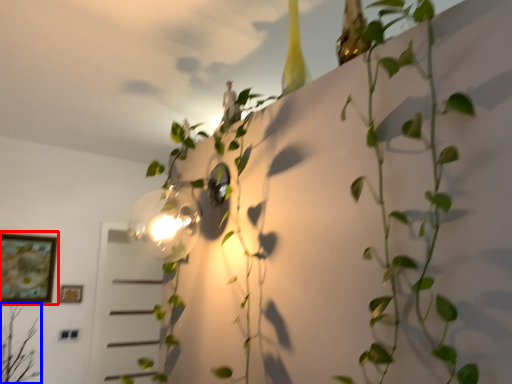
Question: Among these objects, which one is farthest to the camera, picture frame (highlighted by a red box) or plant (highlighted by a blue box)?

Choices:
 (A) picture frame
 (B) plant

Answer: (A)